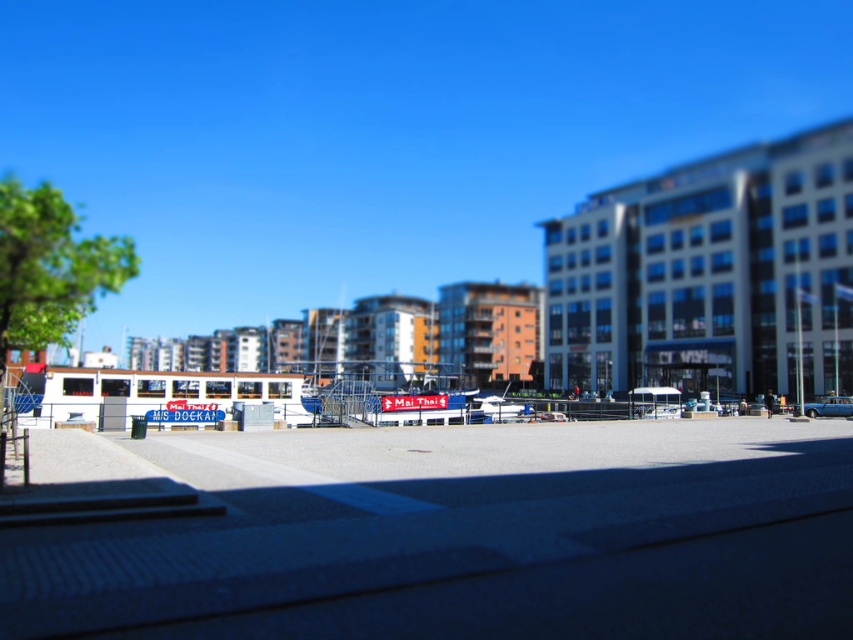
Question: Can you confirm if blue metallic car at center-right is thinner than blue metallic car at center?

Choices:
 (A) no
 (B) yes

Answer: (A)

Question: Does silver metallic car at center have a larger size compared to blue metallic car at center?

Choices:
 (A) no
 (B) yes

Answer: (A)

Question: Among these objects, which one is nearest to the camera?

Choices:
 (A) silver metallic car at center
 (B) blue metallic car at center-right
 (C) blue metallic car at center

Answer: (C)

Question: Estimate the real-world distances between objects in this image. Which object is farther from the silver metallic car at center?

Choices:
 (A) blue metallic car at center-right
 (B) blue metallic car at center

Answer: (A)

Question: Which object is positioned farthest from the blue metallic car at center?

Choices:
 (A) silver metallic car at center
 (B) blue metallic car at center-right

Answer: (B)

Question: Is silver metallic car at center bigger than blue metallic car at center?

Choices:
 (A) no
 (B) yes

Answer: (A)